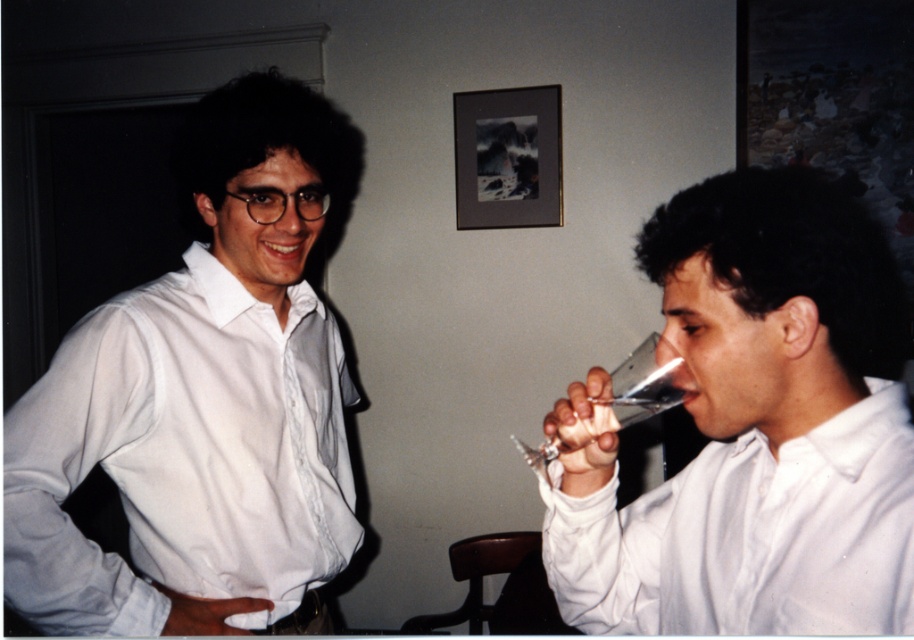
From the picture: Does white glossy shirt at left appear under clear glass wine glass at right?

No, white glossy shirt at left is not below clear glass wine glass at right.

Between white glossy shirt at left and clear glass wine glass at right, which one is positioned lower?

clear glass wine glass at right is below.

Is point (362, 528) closer to camera compared to point (625, 397)?

That is False.

The height and width of the screenshot is (640, 914). In order to click on white glossy shirt at left in this screenshot , I will do `click(202, 403)`.

Who is lower down, white glossy shirt at left or clear glass at right?

clear glass at right is lower down.

Is white glossy shirt at left smaller than clear glass at right?

Incorrect, white glossy shirt at left is not smaller in size than clear glass at right.

Describe the element at coordinates (202, 403) in the screenshot. The width and height of the screenshot is (914, 640). I see `white glossy shirt at left` at that location.

The width and height of the screenshot is (914, 640). What are the coordinates of `white glossy shirt at left` in the screenshot? It's located at (202, 403).

Can you confirm if clear glass at right is positioned above clear glass wine glass at right?

No, clear glass at right is not above clear glass wine glass at right.

Can you confirm if clear glass at right is taller than clear glass wine glass at right?

Indeed, clear glass at right has a greater height compared to clear glass wine glass at right.

Which is behind, point (679, 304) or point (654, 364)?

The point (654, 364) is more distant.

The image size is (914, 640). In order to click on clear glass at right in this screenshot , I will do `click(757, 429)`.